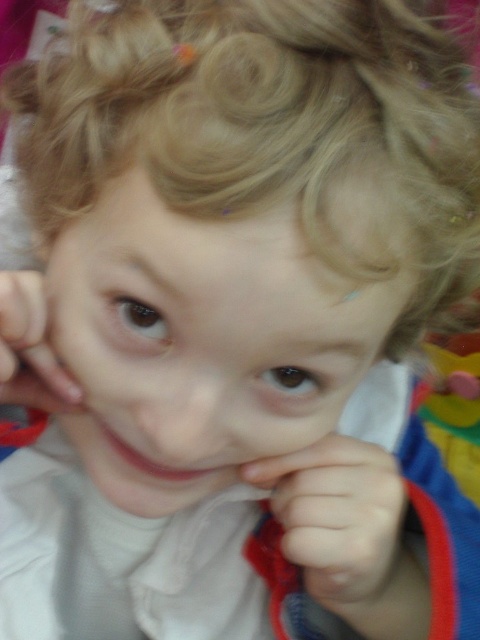
Does smooth skin hand at center appear on the left side of smooth skin hand at left?

No, smooth skin hand at center is not to the left of smooth skin hand at left.

Can you confirm if smooth skin hand at center is bigger than smooth skin hand at left?

Yes, smooth skin hand at center is bigger than smooth skin hand at left.

Image resolution: width=480 pixels, height=640 pixels. I want to click on smooth skin hand at center, so (x=342, y=524).